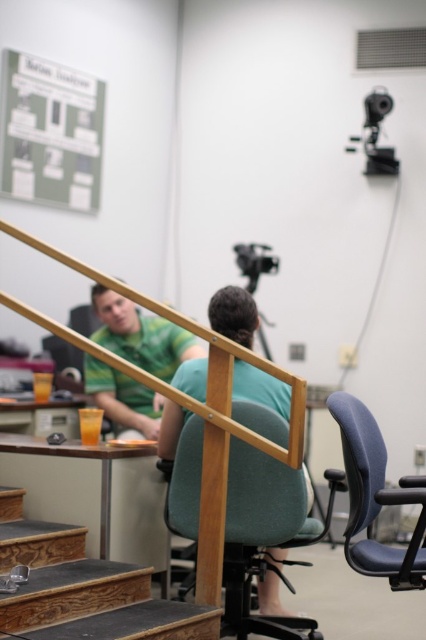
You are standing at the top of the wooden stair at lower left and want to sit down in the green fabric chair at center. Which direction should you move to reach it?

You should move to the right because the wooden stair at lower left is to the left of the green fabric chair at center, so moving right would bring you towards the chair.

You are standing at the bottom of the wooden staircase in the office scene. You notice a point marked at coordinates (141, 333). What object or person is located at that specific coordinate?

The point at coordinates (141, 333) corresponds to the green matte shirt at center.

You are standing in the office scene and want to determine which of the two points, point (175, 612) or point (270, 634), is closer to you. Based on the scene description, which point is nearer?

Point (175, 612) is closer to the viewer than point (270, 634).